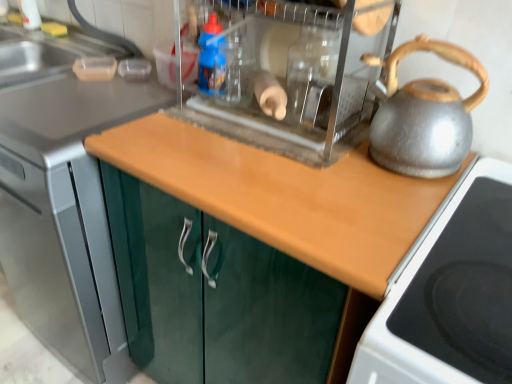
Question: Should I look upward or downward to see wooden at center, placed as the 1th countertop when sorted from left to right?

Choices:
 (A) down
 (B) up

Answer: (A)

Question: Does matte gray sink at upper left come behind wooden at center, placed as the 1th countertop when sorted from left to right?

Choices:
 (A) no
 (B) yes

Answer: (B)

Question: Can you confirm if matte gray sink at upper left is smaller than wooden at center, placed as the 1th countertop when sorted from left to right?

Choices:
 (A) no
 (B) yes

Answer: (B)

Question: Are matte gray sink at upper left and wooden at center, which is the 2th countertop in right-to-left order, far apart?

Choices:
 (A) no
 (B) yes

Answer: (A)

Question: Does matte gray sink at upper left have a greater height compared to wooden at center, placed as the 1th countertop when sorted from left to right?

Choices:
 (A) no
 (B) yes

Answer: (A)

Question: Is matte gray sink at upper left thinner than wooden at center, which is the 2th countertop in right-to-left order?

Choices:
 (A) yes
 (B) no

Answer: (A)

Question: Can you confirm if matte gray sink at upper left is positioned to the left of wooden at center, which is the 2th countertop in right-to-left order?

Choices:
 (A) no
 (B) yes

Answer: (B)

Question: Does blue plastic bottle at center have a lesser height compared to metallic silver kettle at right?

Choices:
 (A) no
 (B) yes

Answer: (B)

Question: Is metallic silver kettle at right at the back of blue plastic bottle at center?

Choices:
 (A) no
 (B) yes

Answer: (B)

Question: From a real-world perspective, does blue plastic bottle at center sit lower than metallic silver kettle at right?

Choices:
 (A) no
 (B) yes

Answer: (B)

Question: Does blue plastic bottle at center have a greater height compared to metallic silver kettle at right?

Choices:
 (A) yes
 (B) no

Answer: (B)

Question: Can you confirm if blue plastic bottle at center is positioned to the right of metallic silver kettle at right?

Choices:
 (A) no
 (B) yes

Answer: (A)

Question: Is there a large distance between blue plastic bottle at center and metallic silver kettle at right?

Choices:
 (A) yes
 (B) no

Answer: (B)

Question: Could you tell me if metallic silver kettle at right is turned towards wooden at center, placed as the 1th countertop when sorted from left to right?

Choices:
 (A) no
 (B) yes

Answer: (A)